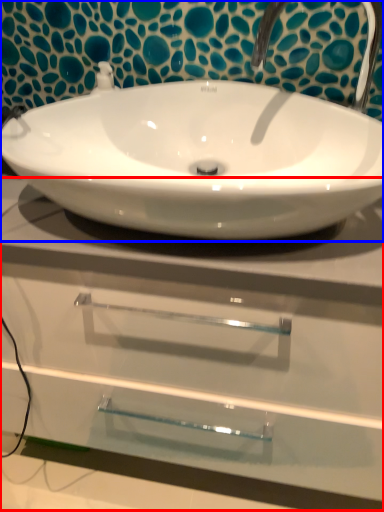
Question: Which object appears closest to the camera in this image, counter top (highlighted by a red box) or sink (highlighted by a blue box)?

Choices:
 (A) counter top
 (B) sink

Answer: (B)